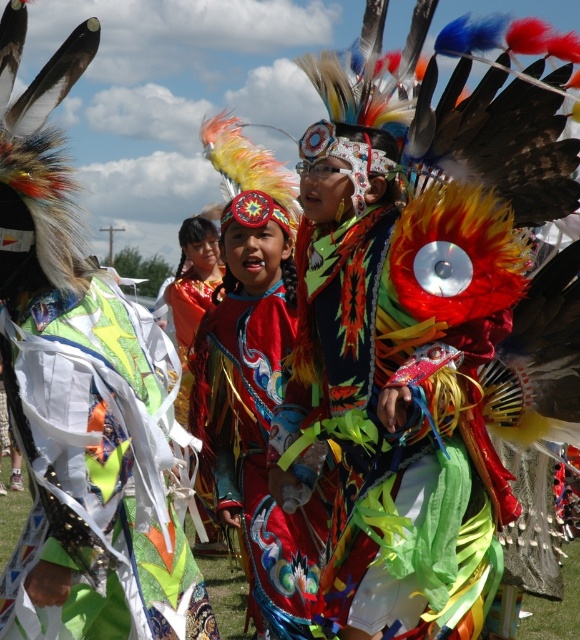
Does shiny metallic fabric at center have a larger size compared to shiny silk dress at center?

No.

Is shiny metallic fabric at center positioned at the back of shiny silk dress at center?

That is False.

What are the coordinates of `shiny metallic fabric at center` in the screenshot? It's located at (99, 470).